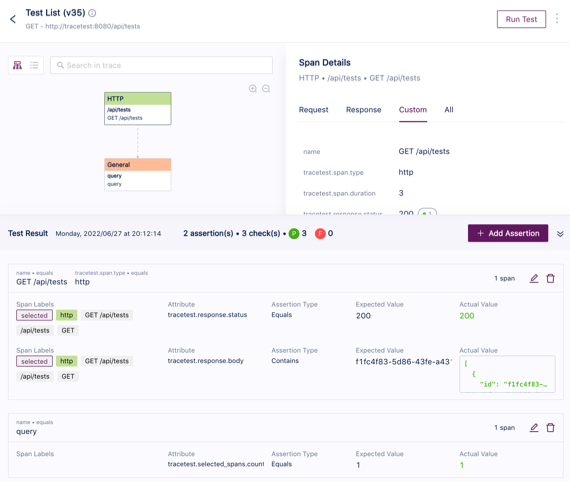
The image size is (570, 482). Identify the location of box. (38, 313), (35, 363), (508, 363), (496, 229), (146, 160), (129, 180), (160, 96), (153, 118), (150, 66), (23, 64).